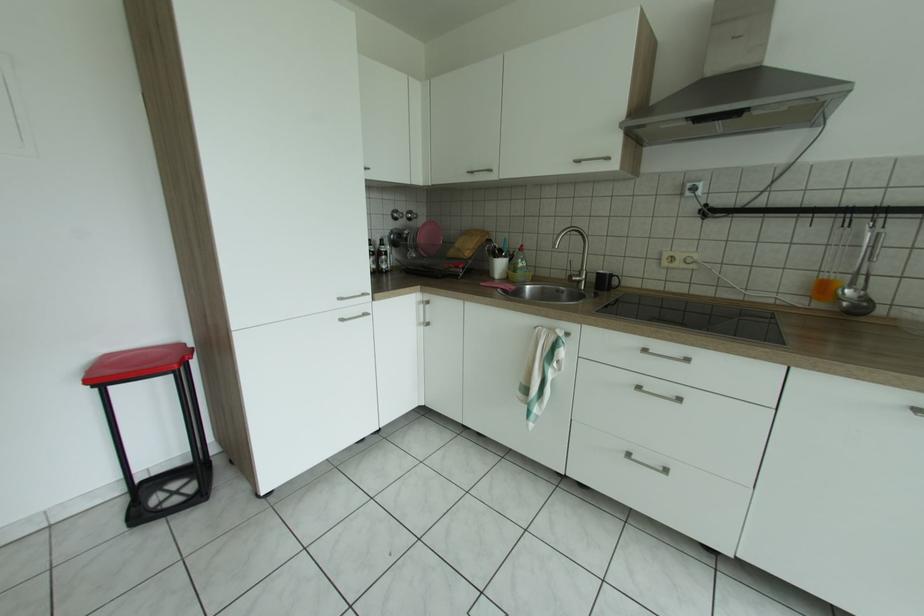
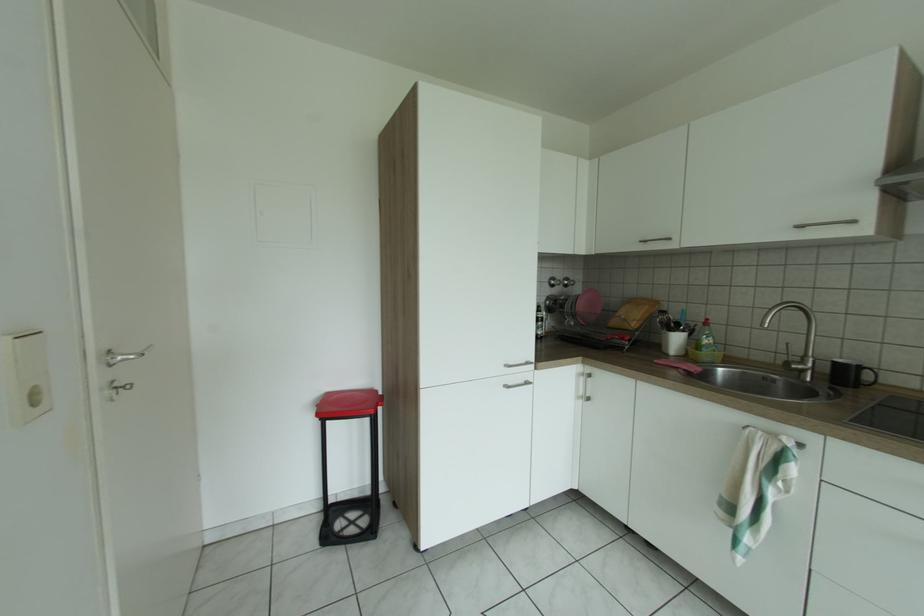
Question: The camera is either moving clockwise (left) or counter-clockwise (right) around the object. The first image is from the beginning of the video and the second image is from the end. Is the camera moving left or right when shooting the video?

Choices:
 (A) Left
 (B) Right

Answer: (B)